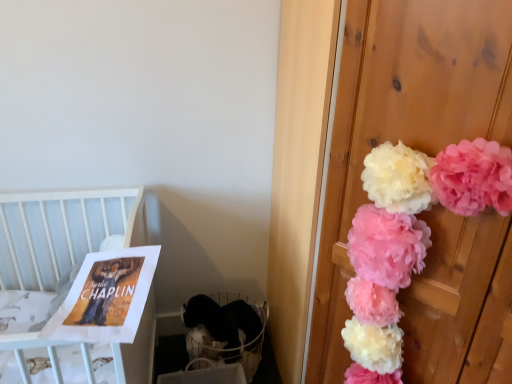
What do you see at coordinates (224, 332) in the screenshot? I see `white fabric baby carriage at lower left` at bounding box center [224, 332].

The width and height of the screenshot is (512, 384). What do you see at coordinates (63, 230) in the screenshot?
I see `white wood crib at upper left` at bounding box center [63, 230].

What are the coordinates of `white fabric baby carriage at lower left` in the screenshot? It's located at (224, 332).

Which is closer to the camera, (128, 314) or (414, 269)?

Point (128, 314) is positioned closer to the camera compared to point (414, 269).

Is matte paper poster at left closer to camera compared to pink fluffy pom-poms at right?

No, matte paper poster at left is further to the viewer.

Is matte paper poster at left in contact with pink fluffy pom-poms at right?

No.

Is matte paper poster at left bigger or smaller than pink fluffy pom-poms at right?

In the image, matte paper poster at left appears to be smaller than pink fluffy pom-poms at right.

Is point (367, 298) closer to camera compared to point (148, 373)?

Yes.

How different are the orientations of pink fluffy pom-poms at right and white wood crib at upper left in degrees?

The angle between the facing direction of pink fluffy pom-poms at right and the facing direction of white wood crib at upper left is 49.2 degrees.

Who is bigger, pink fluffy pom-poms at right or white wood crib at upper left?

With larger size is white wood crib at upper left.

From a real-world perspective, which is physically above, pink fluffy pom-poms at right or white wood crib at upper left?

In real-world perspective, pink fluffy pom-poms at right is above.

Are matte paper poster at left and white fabric baby carriage at lower left located far from each other?

They are positioned close to each other.

Consider the image. Does matte paper poster at left have a greater height compared to white fabric baby carriage at lower left?

No, matte paper poster at left is not taller than white fabric baby carriage at lower left.

Considering the relative positions of matte paper poster at left and white fabric baby carriage at lower left in the image provided, is matte paper poster at left behind white fabric baby carriage at lower left?

No, matte paper poster at left is closer to the viewer.

Are matte paper poster at left and white wood crib at upper left located far from each other?

No.

Consider the image. Is matte paper poster at left thinner than white wood crib at upper left?

Yes.

Considering the sizes of matte paper poster at left and white wood crib at upper left in the image, is matte paper poster at left taller or shorter than white wood crib at upper left?

Clearly, matte paper poster at left is shorter compared to white wood crib at upper left.

You are a GUI agent. You are given a task and a screenshot of the screen. Output one action in this format:
    pyautogui.click(x=<x>, y=<y>)
    Task: Click on the baby carriage on the right of white wood crib at upper left
    Image resolution: width=512 pixels, height=384 pixels.
    Given the screenshot: What is the action you would take?
    pyautogui.click(x=224, y=332)

Is white wood crib at upper left surrounded by white fabric baby carriage at lower left?

Definitely not — white wood crib at upper left is not inside white fabric baby carriage at lower left.

Consider the image. Which object is closer to the camera, white fabric baby carriage at lower left or white wood crib at upper left?

white wood crib at upper left is more forward.

Looking at this image, from a real-world perspective, does white fabric baby carriage at lower left sit lower than white wood crib at upper left?

Correct, in the physical world, white fabric baby carriage at lower left is lower than white wood crib at upper left.

Is pink fluffy pom-poms at right inside the boundaries of matte paper poster at left, or outside?

pink fluffy pom-poms at right is spatially situated outside matte paper poster at left.

Which of these two, pink fluffy pom-poms at right or matte paper poster at left, stands shorter?

matte paper poster at left.

Which of these two, pink fluffy pom-poms at right or matte paper poster at left, is bigger?

pink fluffy pom-poms at right.

From a real-world perspective, who is located higher, white wood crib at upper left or white fabric baby carriage at lower left?

From a 3D spatial view, white wood crib at upper left is above.

Considering the sizes of white wood crib at upper left and white fabric baby carriage at lower left in the image, is white wood crib at upper left wider or thinner than white fabric baby carriage at lower left?

In the image, white wood crib at upper left appears to be wider than white fabric baby carriage at lower left.

Is white wood crib at upper left at the right side of white fabric baby carriage at lower left?

Incorrect, white wood crib at upper left is not on the right side of white fabric baby carriage at lower left.

Which object is further away from the camera, white wood crib at upper left or white fabric baby carriage at lower left?

Positioned behind is white fabric baby carriage at lower left.

At what (x,y) coordinates should I click in order to perform the action: click on floral arrangement that is in front of the matte paper poster at left. Please return your answer as a coordinate pair (x, y). The image size is (512, 384). Looking at the image, I should click on (408, 237).

You are a GUI agent. You are given a task and a screenshot of the screen. Output one action in this format:
    pyautogui.click(x=<x>, y=<y>)
    Task: Click on the floral arrangement that is above the white wood crib at upper left (from the image's perspective)
    Image resolution: width=512 pixels, height=384 pixels.
    Given the screenshot: What is the action you would take?
    pyautogui.click(x=408, y=237)

When comparing their distances from white fabric baby carriage at lower left, does white wood crib at upper left or matte paper poster at left seem closer?

white wood crib at upper left lies closer to white fabric baby carriage at lower left than the other object.

When comparing their distances from matte paper poster at left, does white fabric baby carriage at lower left or pink fluffy pom-poms at right seem further?

white fabric baby carriage at lower left is positioned further to the anchor matte paper poster at left.

Looking at the image, which one is located further to white fabric baby carriage at lower left, white wood crib at upper left or pink fluffy pom-poms at right?

The object further to white fabric baby carriage at lower left is pink fluffy pom-poms at right.

Looking at the image, which one is located closer to white wood crib at upper left, matte paper poster at left or white fabric baby carriage at lower left?

Based on the image, matte paper poster at left appears to be nearer to white wood crib at upper left.

From the image, which object appears to be farther from pink fluffy pom-poms at right, white wood crib at upper left or matte paper poster at left?

white wood crib at upper left lies further to pink fluffy pom-poms at right than the other object.

Based on their spatial positions, is matte paper poster at left or white wood crib at upper left closer to pink fluffy pom-poms at right?

The object closer to pink fluffy pom-poms at right is matte paper poster at left.

From the image, which object appears to be nearer to white fabric baby carriage at lower left, matte paper poster at left or pink fluffy pom-poms at right?

Based on the image, matte paper poster at left appears to be nearer to white fabric baby carriage at lower left.

Looking at the image, which one is located closer to matte paper poster at left, white wood crib at upper left or pink fluffy pom-poms at right?

white wood crib at upper left lies closer to matte paper poster at left than the other object.

The width and height of the screenshot is (512, 384). I want to click on magazine between white wood crib at upper left and pink fluffy pom-poms at right in the horizontal direction, so click(x=106, y=297).

Identify the location of magazine between white wood crib at upper left and white fabric baby carriage at lower left along the z-axis. This screenshot has height=384, width=512. click(x=106, y=297).

Image resolution: width=512 pixels, height=384 pixels. I want to click on magazine between pink fluffy pom-poms at right and white fabric baby carriage at lower left from front to back, so click(106, 297).

In order to click on baby carriage between white wood crib at upper left and pink fluffy pom-poms at right in the horizontal direction in this screenshot , I will do `click(224, 332)`.